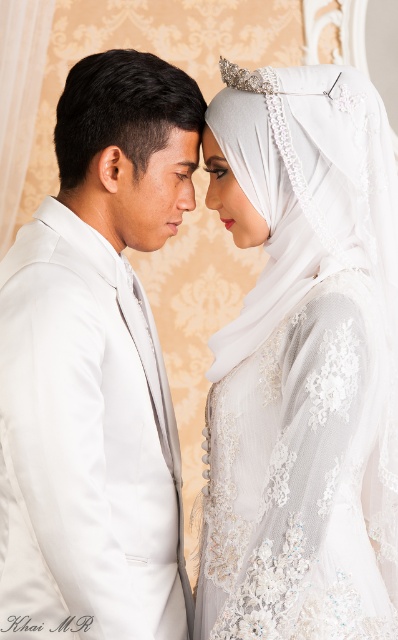
Question: Does matte white suit at left lie in front of matte skin forehead at center?

Choices:
 (A) no
 (B) yes

Answer: (B)

Question: Which point is farther to the camera?

Choices:
 (A) (277, 417)
 (B) (15, 349)
 (C) (191, 138)

Answer: (C)

Question: Does white lace hijab at upper center have a lesser width compared to matte white suit at left?

Choices:
 (A) yes
 (B) no

Answer: (B)

Question: Is white lace hijab at upper center to the right of matte white suit at left from the viewer's perspective?

Choices:
 (A) no
 (B) yes

Answer: (B)

Question: Estimate the real-world distances between objects in this image. Which object is farther from the white lace hijab at upper center?

Choices:
 (A) matte white suit at left
 (B) matte skin forehead at center

Answer: (B)

Question: Which point is closer to the camera?

Choices:
 (A) (165, 147)
 (B) (146, 604)

Answer: (B)